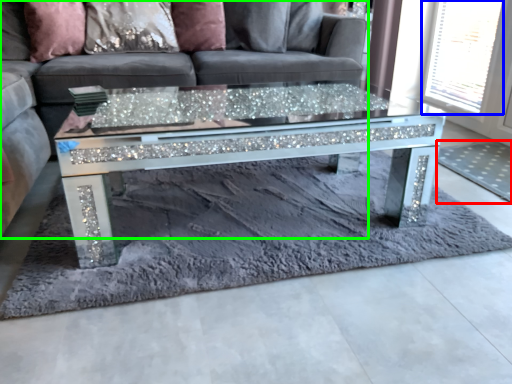
Question: Which object is positioned closest to mat (highlighted by a red box)? Select from window screen (highlighted by a blue box) and studio couch (highlighted by a green box).

Choices:
 (A) window screen
 (B) studio couch

Answer: (A)